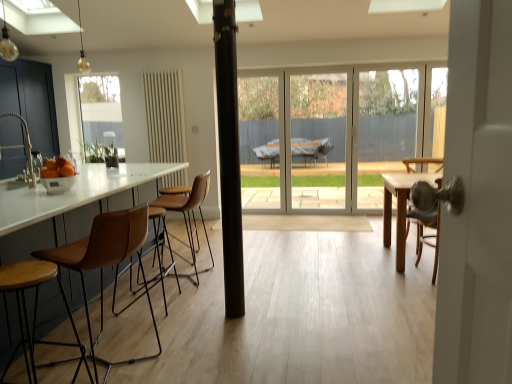
Question: Considering their positions, is transparent glass door at center located in front of or behind matte gold bulb at upper left, acting as the second light fixture starting from the front?

Choices:
 (A) behind
 (B) front

Answer: (A)

Question: From their relative heights in the image, would you say transparent glass door at center is taller or shorter than matte gold bulb at upper left, positioned as the first light fixture in right-to-left order?

Choices:
 (A) short
 (B) tall

Answer: (B)

Question: Considering the real-world distances, which object is closest to the brown leather stool at left?

Choices:
 (A) matte gold bulb at upper left, the second light fixture when ordered from left to right
 (B) black matte pole at center
 (C) transparent glass door at center
 (D) matte silver faucet at left
 (E) matte black cabinets at left

Answer: (B)

Question: Which object is the closest to the matte black cabinets at left?

Choices:
 (A) matte gold bulb at upper left, acting as the second light fixture starting from the front
 (B) orange matte bowl at left
 (C) matte silver faucet at left
 (D) matte glass bulb at upper left, positioned as the 1th light fixture in front-to-back order
 (E) transparent glass door at center

Answer: (C)